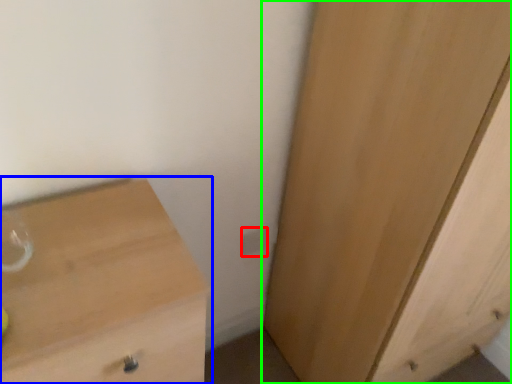
Question: Which is farther away from electric outlet (highlighted by a red box)? chest of drawers (highlighted by a blue box) or cupboard (highlighted by a green box)?

Choices:
 (A) chest of drawers
 (B) cupboard

Answer: (A)